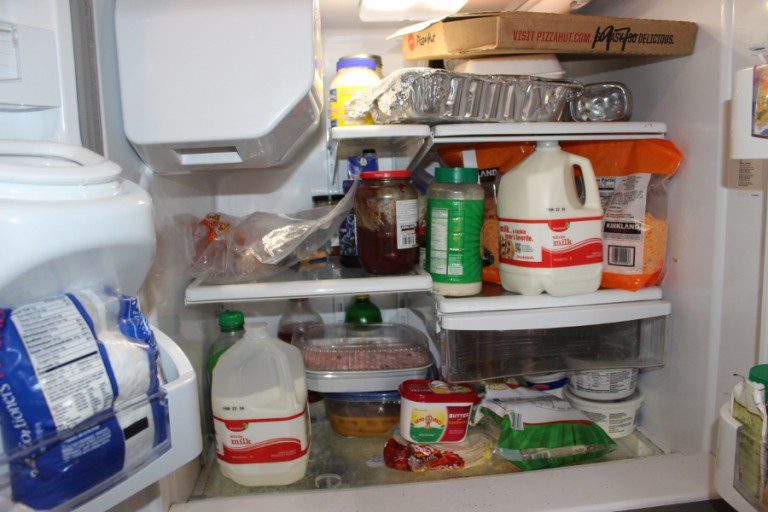
Locate an element on the screen. The image size is (768, 512). green bottle is located at coordinates (363, 313).